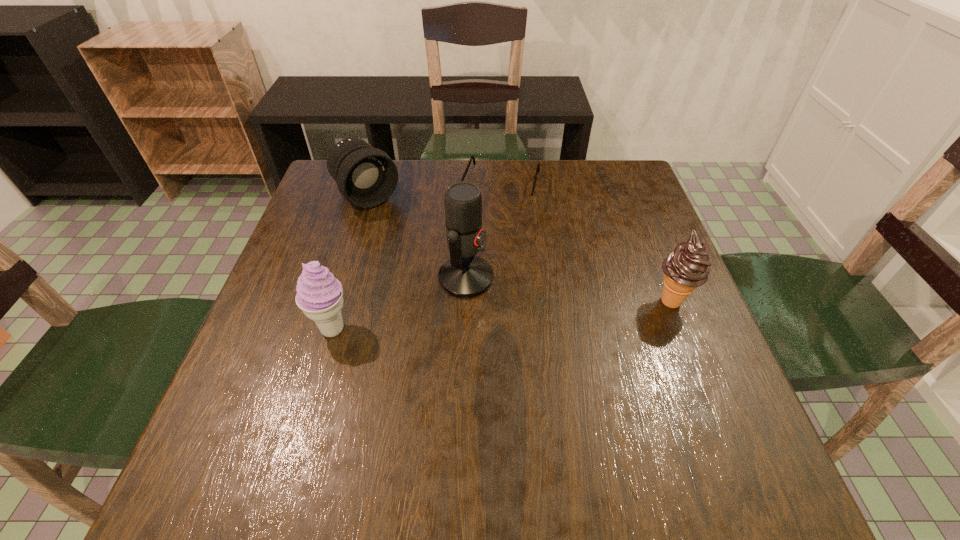
The image size is (960, 540). Identify the location of the left icecream. (319, 295).

Find the location of a particular element. Image resolution: width=960 pixels, height=540 pixels. the right icecream is located at coordinates (687, 267).

In order to click on telephoto lens in this screenshot , I will do `click(366, 177)`.

Locate an element on the screen. The image size is (960, 540). the tallest object is located at coordinates (464, 275).

This screenshot has height=540, width=960. I want to click on the shortest object, so click(x=512, y=200).

Locate an element on the screen. This screenshot has height=540, width=960. free location located 0.160m on the front of the left icecream is located at coordinates (306, 424).

Find the location of a particular element. The width and height of the screenshot is (960, 540). vacant space located on the front of the rightmost object is located at coordinates [x=722, y=428].

You are a GUI agent. You are given a task and a screenshot of the screen. Output one action in this format:
    pyautogui.click(x=<x>, y=<y>)
    Task: Click on the vacant region located at the front element of the fourth tallest object
    The width and height of the screenshot is (960, 540).
    Given the screenshot: What is the action you would take?
    pyautogui.click(x=396, y=227)

The image size is (960, 540). I want to click on vacant space located 0.370m at the front element of the fourth tallest object, so click(465, 299).

At what (x,y) coordinates should I click in order to perform the action: click on free space located at the front element of the fourth tallest object. Please return your answer as a coordinate pair (x, y). Looking at the image, I should click on (420, 251).